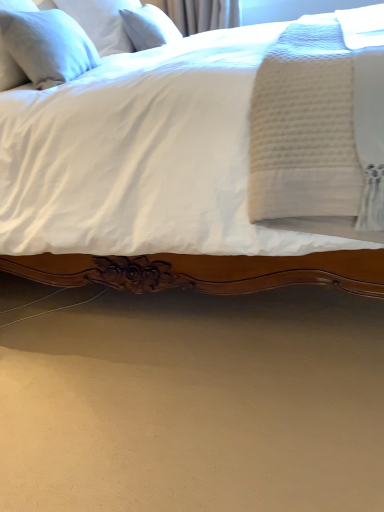
This screenshot has height=512, width=384. What do you see at coordinates (149, 27) in the screenshot? I see `white soft pillow at upper left, the 1th pillow when ordered from back to front` at bounding box center [149, 27].

What is the approximate height of white soft pillow at upper left, marked as the second pillow in a front-to-back arrangement?

It is 11.40 inches.

At what (x,y) coordinates should I click in order to perform the action: click on white linen pillow at upper left, the third pillow viewed from the back. Please return your answer as a coordinate pair (x, y). The width and height of the screenshot is (384, 512). Looking at the image, I should click on (47, 46).

Considering their positions, is white soft pillow at upper left, which is the 2th pillow from back to front, located in front of or behind white linen pillow at upper left, the third pillow viewed from the back?

Visually, white soft pillow at upper left, which is the 2th pillow from back to front, is located behind white linen pillow at upper left, the third pillow viewed from the back.

Is white soft pillow at upper left, which is the 2th pillow from back to front, beside white linen pillow at upper left, the third pillow viewed from the back?

No, white soft pillow at upper left, which is the 2th pillow from back to front, is not with white linen pillow at upper left, the third pillow viewed from the back.

Consider the image. Is white soft pillow at upper left, which is the 2th pillow from back to front, facing towards white linen pillow at upper left, the third pillow viewed from the back?

No, white soft pillow at upper left, which is the 2th pillow from back to front, is not turned towards white linen pillow at upper left, the third pillow viewed from the back.

What's the angular difference between white soft pillow at upper left, marked as the second pillow in a front-to-back arrangement, and white linen pillow at upper left, placed as the first pillow when sorted from front to back,'s facing directions?

5.8 degrees.

Considering the relative sizes of white soft pillow at upper left, the 1th pillow when ordered from back to front, and white soft pillow at upper left, marked as the second pillow in a front-to-back arrangement, in the image provided, is white soft pillow at upper left, the 1th pillow when ordered from back to front, shorter than white soft pillow at upper left, marked as the second pillow in a front-to-back arrangement,?

Correct, white soft pillow at upper left, the 1th pillow when ordered from back to front, is not as tall as white soft pillow at upper left, marked as the second pillow in a front-to-back arrangement.

Considering the relative sizes of white soft pillow at upper left, which is counted as the third pillow, starting from the front, and white soft pillow at upper left, marked as the second pillow in a front-to-back arrangement, in the image provided, is white soft pillow at upper left, which is counted as the third pillow, starting from the front, thinner than white soft pillow at upper left, marked as the second pillow in a front-to-back arrangement,?

Correct, the width of white soft pillow at upper left, which is counted as the third pillow, starting from the front, is less than that of white soft pillow at upper left, marked as the second pillow in a front-to-back arrangement.

Consider the image. Can you confirm if white soft pillow at upper left, the 1th pillow when ordered from back to front, is bigger than white soft pillow at upper left, which is the 2th pillow from back to front?

No, white soft pillow at upper left, the 1th pillow when ordered from back to front, is not bigger than white soft pillow at upper left, which is the 2th pillow from back to front.

From the image's perspective, does white soft pillow at upper left, which is counted as the third pillow, starting from the front, appear lower than white soft pillow at upper left, which is the 2th pillow from back to front?

Indeed, from the image's perspective, white soft pillow at upper left, which is counted as the third pillow, starting from the front, is shown beneath white soft pillow at upper left, which is the 2th pillow from back to front.

From the image's perspective, who appears lower, white linen pillow at upper left, placed as the first pillow when sorted from front to back, or white soft pillow at upper left, marked as the second pillow in a front-to-back arrangement?

From the image's view, white linen pillow at upper left, placed as the first pillow when sorted from front to back, is below.

Can you tell me how much white linen pillow at upper left, the third pillow viewed from the back, and white soft pillow at upper left, marked as the second pillow in a front-to-back arrangement, differ in facing direction?

5.8 degrees.

Looking at their sizes, would you say white linen pillow at upper left, placed as the first pillow when sorted from front to back, is wider or thinner than white soft pillow at upper left, which is the 2th pillow from back to front?

Considering their sizes, white linen pillow at upper left, placed as the first pillow when sorted from front to back, looks slimmer than white soft pillow at upper left, which is the 2th pillow from back to front.

Who is shorter, white linen pillow at upper left, placed as the first pillow when sorted from front to back, or white soft pillow at upper left, marked as the second pillow in a front-to-back arrangement?

With less height is white linen pillow at upper left, placed as the first pillow when sorted from front to back.

In the scene shown: Considering the sizes of white linen pillow at upper left, placed as the first pillow when sorted from front to back, and white soft pillow at upper left, the 1th pillow when ordered from back to front, in the image, is white linen pillow at upper left, placed as the first pillow when sorted from front to back, bigger or smaller than white soft pillow at upper left, the 1th pillow when ordered from back to front,?

In the image, white linen pillow at upper left, placed as the first pillow when sorted from front to back, appears to be larger than white soft pillow at upper left, the 1th pillow when ordered from back to front.

Would you say white linen pillow at upper left, placed as the first pillow when sorted from front to back, is outside white soft pillow at upper left, the 1th pillow when ordered from back to front?

white linen pillow at upper left, placed as the first pillow when sorted from front to back, lies outside white soft pillow at upper left, the 1th pillow when ordered from back to front,'s area.

In the image, is white linen pillow at upper left, placed as the first pillow when sorted from front to back, positioned in front of or behind white soft pillow at upper left, the 1th pillow when ordered from back to front?

white linen pillow at upper left, placed as the first pillow when sorted from front to back, is in front of white soft pillow at upper left, the 1th pillow when ordered from back to front.

From the image's perspective, is white linen pillow at upper left, placed as the first pillow when sorted from front to back, above white soft pillow at upper left, which is counted as the third pillow, starting from the front?

No, from the image's perspective, white linen pillow at upper left, placed as the first pillow when sorted from front to back, is not over white soft pillow at upper left, which is counted as the third pillow, starting from the front.

Is white soft pillow at upper left, which is the 2th pillow from back to front, in front of or behind white soft pillow at upper left, which is counted as the third pillow, starting from the front, in the image?

white soft pillow at upper left, which is the 2th pillow from back to front, is in front of white soft pillow at upper left, which is counted as the third pillow, starting from the front.

Based on the photo, is white soft pillow at upper left, marked as the second pillow in a front-to-back arrangement, facing away from white soft pillow at upper left, the 1th pillow when ordered from back to front?

Absolutely, white soft pillow at upper left, marked as the second pillow in a front-to-back arrangement, is directed away from white soft pillow at upper left, the 1th pillow when ordered from back to front.

Considering the sizes of white soft pillow at upper left, which is the 2th pillow from back to front, and white soft pillow at upper left, which is counted as the third pillow, starting from the front, in the image, is white soft pillow at upper left, which is the 2th pillow from back to front, wider or thinner than white soft pillow at upper left, which is counted as the third pillow, starting from the front,?

Clearly, white soft pillow at upper left, which is the 2th pillow from back to front, has more width compared to white soft pillow at upper left, which is counted as the third pillow, starting from the front.

Which is more to the left, white soft pillow at upper left, which is the 2th pillow from back to front, or white soft pillow at upper left, which is counted as the third pillow, starting from the front?

From the viewer's perspective, white soft pillow at upper left, which is the 2th pillow from back to front, appears more on the left side.

In terms of size, does white soft pillow at upper left, the 1th pillow when ordered from back to front, appear bigger or smaller than white linen pillow at upper left, the third pillow viewed from the back?

Considering their sizes, white soft pillow at upper left, the 1th pillow when ordered from back to front, takes up less space than white linen pillow at upper left, the third pillow viewed from the back.

I want to click on pillow that is the 1st object above the white linen pillow at upper left, the third pillow viewed from the back (from a real-world perspective), so click(149, 27).

Between white soft pillow at upper left, which is counted as the third pillow, starting from the front, and white linen pillow at upper left, the third pillow viewed from the back, which one is positioned in front?

Positioned in front is white linen pillow at upper left, the third pillow viewed from the back.

Which point is more distant from viewer, [177,30] or [28,55]?

The point [177,30] is behind.

At what (x,y) coordinates should I click in order to perform the action: click on pillow that is the 1st one when counting backward from the white linen pillow at upper left, the third pillow viewed from the back. Please return your answer as a coordinate pair (x, y). The height and width of the screenshot is (512, 384). Looking at the image, I should click on (102, 22).

The height and width of the screenshot is (512, 384). What are the coordinates of `pillow above the white soft pillow at upper left, the 1th pillow when ordered from back to front (from a real-world perspective)` in the screenshot? It's located at (102, 22).

Looking at the image, which one is located further to white soft pillow at upper left, which is the 2th pillow from back to front, white soft pillow at upper left, the 1th pillow when ordered from back to front, or white linen pillow at upper left, placed as the first pillow when sorted from front to back?

white linen pillow at upper left, placed as the first pillow when sorted from front to back, is further to white soft pillow at upper left, which is the 2th pillow from back to front.

Estimate the real-world distances between objects in this image. Which object is closer to white soft pillow at upper left, the 1th pillow when ordered from back to front, white linen pillow at upper left, placed as the first pillow when sorted from front to back, or white soft pillow at upper left, which is the 2th pillow from back to front?

white soft pillow at upper left, which is the 2th pillow from back to front, is closer to white soft pillow at upper left, the 1th pillow when ordered from back to front.

From the image, which object appears to be nearer to white soft pillow at upper left, marked as the second pillow in a front-to-back arrangement, white linen pillow at upper left, placed as the first pillow when sorted from front to back, or white soft pillow at upper left, the 1th pillow when ordered from back to front?

The object closer to white soft pillow at upper left, marked as the second pillow in a front-to-back arrangement, is white soft pillow at upper left, the 1th pillow when ordered from back to front.

Looking at the image, which one is located closer to white linen pillow at upper left, the third pillow viewed from the back, white soft pillow at upper left, which is the 2th pillow from back to front, or white soft pillow at upper left, which is counted as the third pillow, starting from the front?

white soft pillow at upper left, which is the 2th pillow from back to front.

Based on their spatial positions, is white soft pillow at upper left, which is counted as the third pillow, starting from the front, or white soft pillow at upper left, marked as the second pillow in a front-to-back arrangement, closer to white linen pillow at upper left, placed as the first pillow when sorted from front to back?

white soft pillow at upper left, marked as the second pillow in a front-to-back arrangement, is positioned closer to the anchor white linen pillow at upper left, placed as the first pillow when sorted from front to back.

Which object lies nearer to the anchor point white soft pillow at upper left, the 1th pillow when ordered from back to front, white soft pillow at upper left, which is the 2th pillow from back to front, or white linen pillow at upper left, placed as the first pillow when sorted from front to back?

white soft pillow at upper left, which is the 2th pillow from back to front, lies closer to white soft pillow at upper left, the 1th pillow when ordered from back to front, than the other object.

Locate an element on the screen. This screenshot has width=384, height=512. pillow between white linen pillow at upper left, placed as the first pillow when sorted from front to back, and white soft pillow at upper left, which is counted as the third pillow, starting from the front, in the front-back direction is located at coordinates (102, 22).